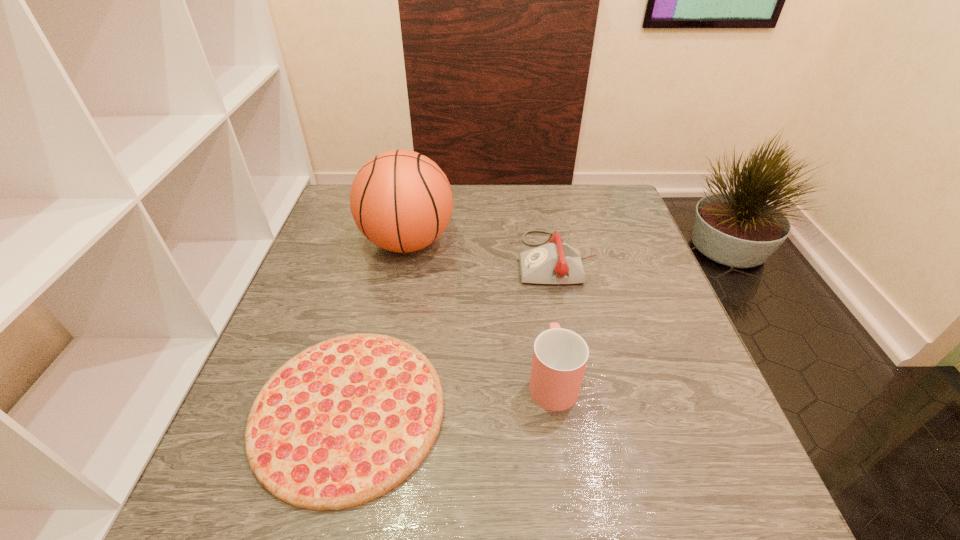
Where is `vacant space at the left edge`? This screenshot has height=540, width=960. vacant space at the left edge is located at coordinates (304, 269).

Where is `vacant space at the right edge of the desktop`? The height and width of the screenshot is (540, 960). vacant space at the right edge of the desktop is located at coordinates (669, 332).

In the image, there is a desktop. At what (x,y) coordinates should I click in order to perform the action: click on vacant region at the near right corner. Please return your answer as a coordinate pair (x, y). Looking at the image, I should click on (x=748, y=494).

In order to click on empty space between the second tallest object and the third tallest object in this screenshot , I will do `click(555, 319)`.

At what (x,y) coordinates should I click in order to perform the action: click on unoccupied position between the third shortest object and the telephone. Please return your answer as a coordinate pair (x, y). Looking at the image, I should click on (555, 319).

The height and width of the screenshot is (540, 960). Identify the location of free space between the third shortest object and the tallest object. (480, 311).

The height and width of the screenshot is (540, 960). I want to click on empty space that is in between the tallest object and the shortest object, so click(x=378, y=327).

At what (x,y) coordinates should I click in order to perform the action: click on free space between the pizza and the second shortest object. Please return your answer as a coordinate pair (x, y). The height and width of the screenshot is (540, 960). Looking at the image, I should click on (453, 335).

I want to click on free space between the second tallest object and the tallest object, so pyautogui.click(x=480, y=311).

I want to click on free space between the cup and the tallest object, so click(x=480, y=311).